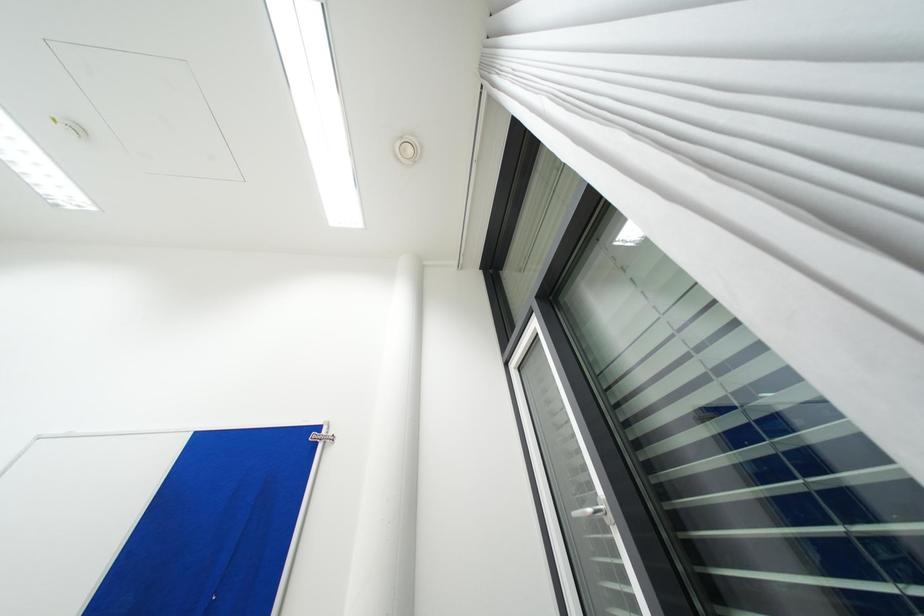
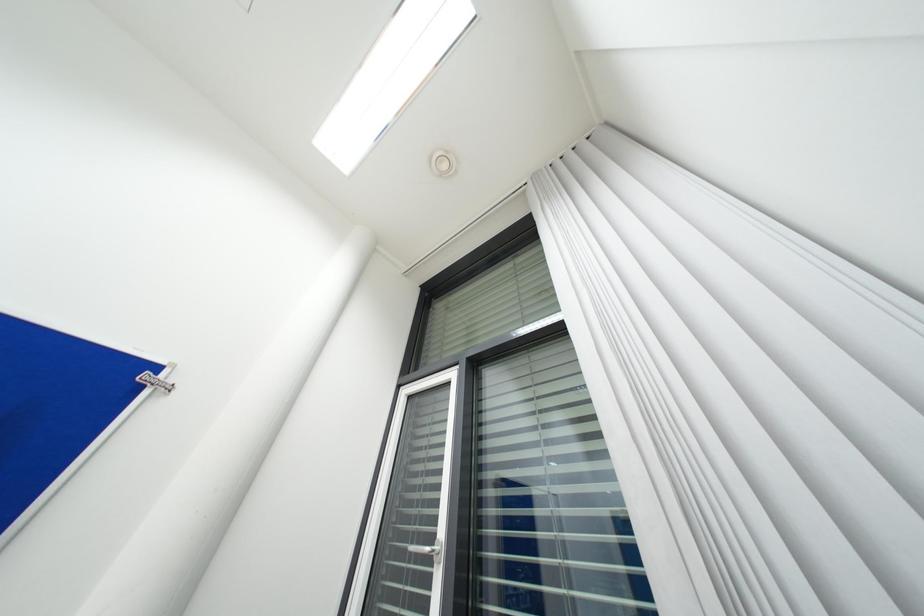
Question: The first image is from the beginning of the video and the second image is from the end. How did the camera likely rotate when shooting the video?

Choices:
 (A) Left
 (B) Right
 (C) Up
 (D) Down

Answer: (B)